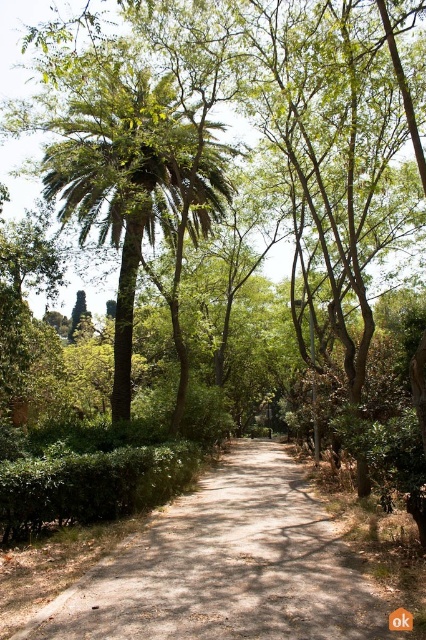
You are a hiker carrying a backpack and want to take a photo of the dirt path at center and the green leafy palm tree at upper left. If your camera can capture objects within a 10 meter range, will both be in the same photo?

The dirt path at center and green leafy palm tree at upper left are 9.26 meters apart, so yes, both will be in the same photo since the distance between them is within the camera range.

You are standing at the starting point of the dirt path at center. There is a point marked at coordinates (227, 566). Based on the scene description, can you determine if this point is located on the dirt path or off to the side?

The point at coordinates (227, 566) is on the dirt path at center, so yes, it is located on the dirt path.